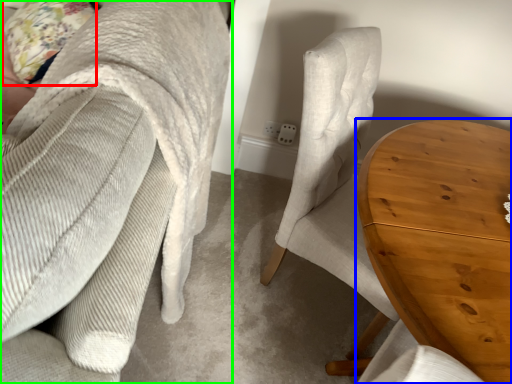
Question: Which is nearer to the pillow (highlighted by a red box)? table (highlighted by a blue box) or chair (highlighted by a green box).

Choices:
 (A) table
 (B) chair

Answer: (B)